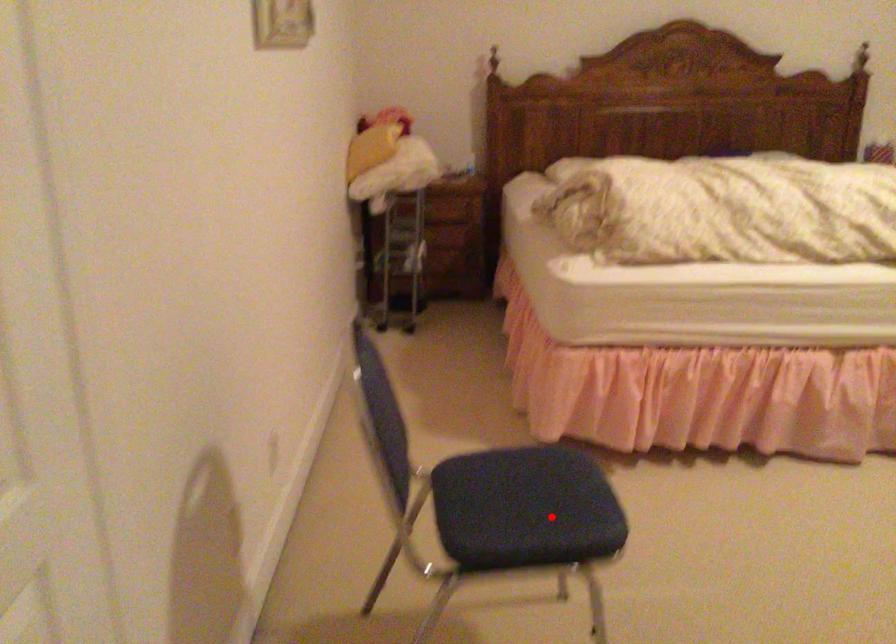
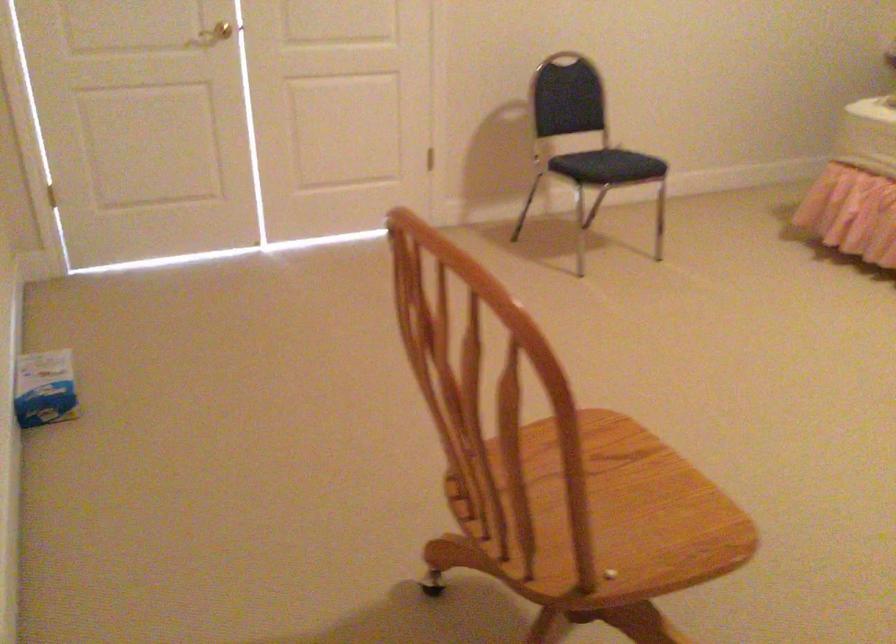
Question: I am providing you with two images of the same scene from different viewpoints. Given a red point in image1, look at the same physical point in image2. Is it:

Choices:
 (A) Closer to the viewpoint
 (B) Farther from the viewpoint

Answer: (B)